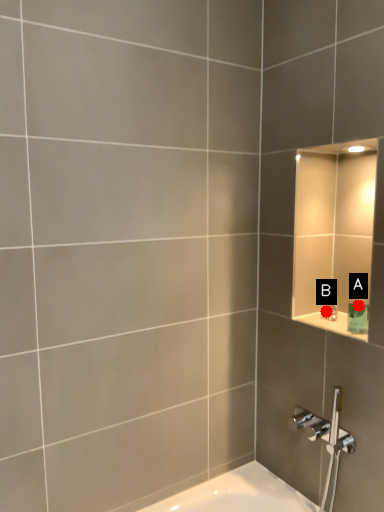
Question: Two points are circled on the image, labeled by A and B beside each circle. Which point appears farthest from the camera in this image?

Choices:
 (A) A is further
 (B) B is further

Answer: (B)